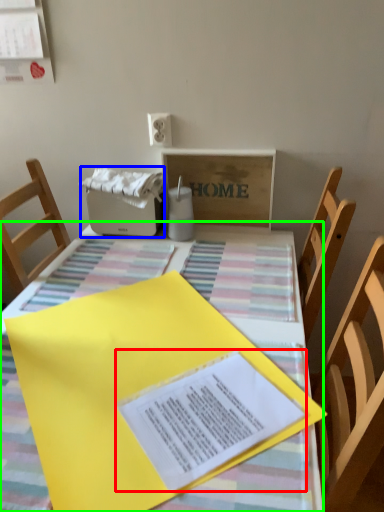
Question: Considering the real-world distances, which object is farthest from journal (highlighted by a red box)? appliance (highlighted by a blue box) or table (highlighted by a green box)?

Choices:
 (A) appliance
 (B) table

Answer: (A)